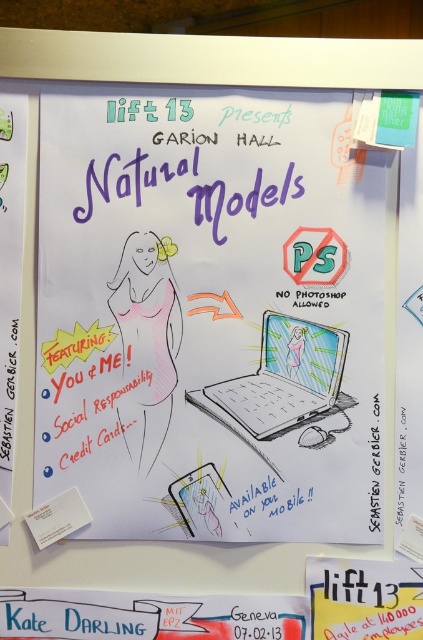
You are organizing a presentation and need to place both the white paperboard at center and the matte gray laptop at center on a desk. Given their sizes, which object should you place first to ensure there is enough space for both?

The white paperboard at center is larger than the matte gray laptop at center, so you should place the white paperboard at center first to ensure there is enough space for both.

Looking at the poster on the whiteboard, there are two points labeled as point 1 and point 2. Point 1 is at coordinates [253,323] and point 2 is at [340,364]. Which point is closer to the camera?

Point 1 at coordinates [253,323] is closer to the camera than point 2 at [340,364].